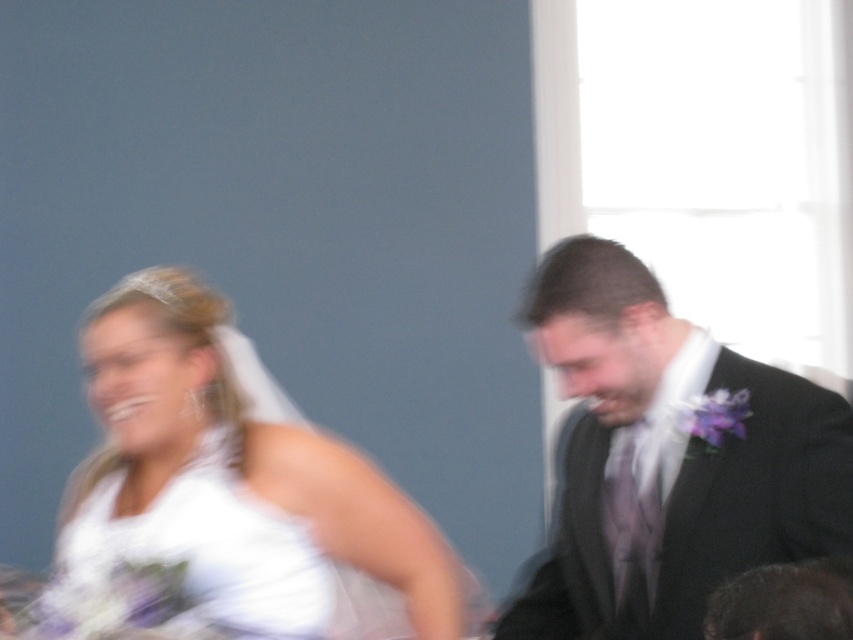
Question: Which point is farther from the camera taking this photo?

Choices:
 (A) (248, 570)
 (B) (224, 454)

Answer: (B)

Question: Does matte black suit at right lie in front of white satin wedding dress at left?

Choices:
 (A) no
 (B) yes

Answer: (B)

Question: Is white satin dress at left wider than matte black suit at right?

Choices:
 (A) no
 (B) yes

Answer: (B)

Question: Which object is farther from the camera taking this photo?

Choices:
 (A) white satin wedding dress at left
 (B) white satin dress at left

Answer: (A)

Question: Where is white satin dress at left located in relation to white satin wedding dress at left in the image?

Choices:
 (A) right
 (B) left

Answer: (A)

Question: Which object is farther from the camera taking this photo?

Choices:
 (A) white satin wedding dress at left
 (B) matte black suit at right

Answer: (A)